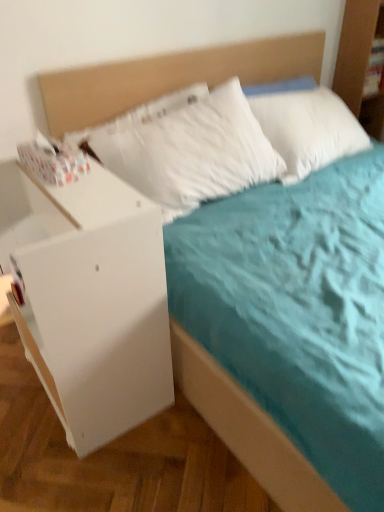
The height and width of the screenshot is (512, 384). What do you see at coordinates (90, 298) in the screenshot? I see `white matte dresser at left` at bounding box center [90, 298].

The width and height of the screenshot is (384, 512). Find the location of `white matte dresser at left`. white matte dresser at left is located at coordinates (90, 298).

Identify the location of white matte dresser at left. This screenshot has width=384, height=512. (90, 298).